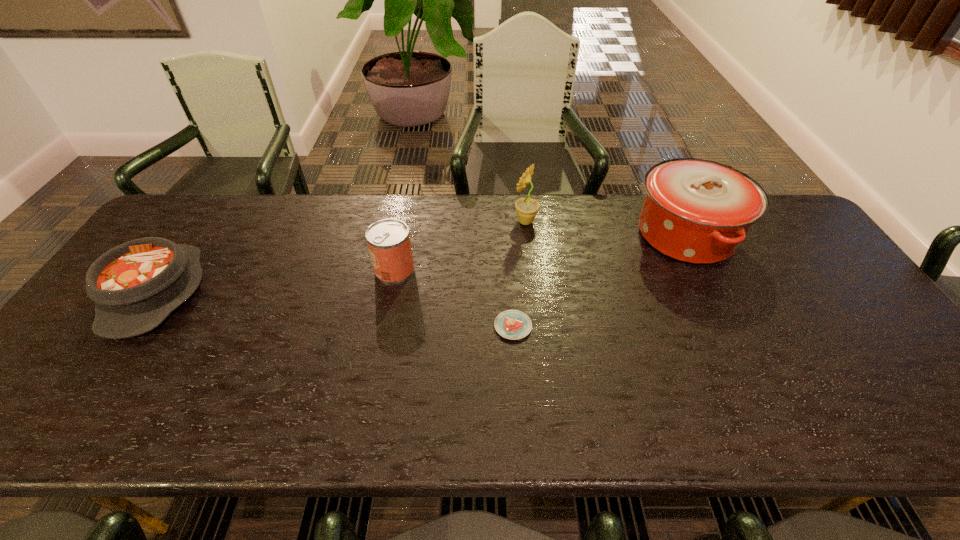
You are a GUI agent. You are given a task and a screenshot of the screen. Output one action in this format:
    pyautogui.click(x=<x>, y=<y>)
    Task: Click on the blank space located 0.370m on the face of the sunflower
    The height and width of the screenshot is (540, 960).
    Given the screenshot: What is the action you would take?
    pyautogui.click(x=396, y=221)

Image resolution: width=960 pixels, height=540 pixels. Find the location of `vacant space located 0.370m on the face of the sunflower`. vacant space located 0.370m on the face of the sunflower is located at coordinates (396, 221).

At what (x,y) coordinates should I click in order to perform the action: click on vacant area located on the front of the second object from left to right. Please return your answer as a coordinate pair (x, y). Looking at the image, I should click on coord(386,315).

Identify the location of vacant space located on the front of the leftmost object. The image size is (960, 540). (78, 407).

Find the location of `free location located on the back of the pastry`. free location located on the back of the pastry is located at coordinates (507, 238).

Where is `casserole positioned at the far edge`? The height and width of the screenshot is (540, 960). casserole positioned at the far edge is located at coordinates (697, 211).

At what (x,y) coordinates should I click in order to perform the action: click on sunflower situated at the far edge. Please return your answer as a coordinate pair (x, y). Image resolution: width=960 pixels, height=540 pixels. Looking at the image, I should click on click(x=526, y=208).

Locate an element on the screen. Image resolution: width=960 pixels, height=540 pixels. object present at the left edge is located at coordinates (135, 286).

Locate an element on the screen. Image resolution: width=960 pixels, height=540 pixels. free location at the far edge is located at coordinates (311, 196).

The image size is (960, 540). Find the location of `blank space at the near edge of the desktop`. blank space at the near edge of the desktop is located at coordinates (864, 418).